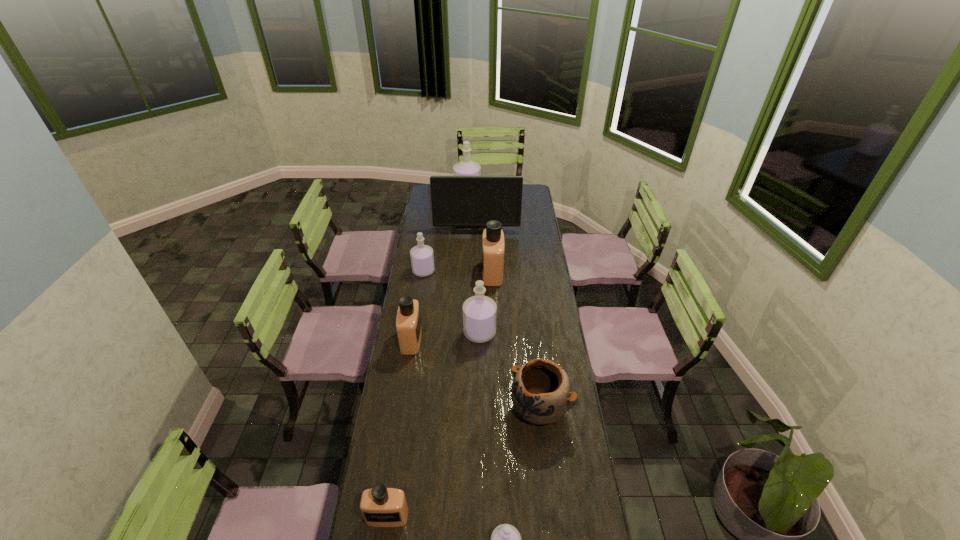
The height and width of the screenshot is (540, 960). I want to click on vacant space located on the front of the leftmost purple perfume, so click(x=416, y=321).

Identify the location of free point located 0.290m on the front label of the second smallest beige perfume. (487, 340).

This screenshot has height=540, width=960. Identify the location of free space located 0.140m on the back of the pottery. (534, 356).

Find the location of a particular element. object present at the far edge is located at coordinates (x=466, y=167).

You are a GUI agent. You are given a task and a screenshot of the screen. Output one action in this format:
    pyautogui.click(x=<x>, y=<y>)
    Task: Click on the computer monitor that is positioned at the left edge
    The image size is (960, 540).
    Given the screenshot: What is the action you would take?
    pyautogui.click(x=457, y=201)

The width and height of the screenshot is (960, 540). Find the location of `computer monitor that is at the right edge`. computer monitor that is at the right edge is located at coordinates (457, 201).

I want to click on pottery that is at the right edge, so click(x=541, y=393).

Locate an element on the screen. The height and width of the screenshot is (540, 960). free space at the left edge of the desktop is located at coordinates (410, 295).

In the image, there is a desktop. Where is `vacant space at the right edge`? This screenshot has height=540, width=960. vacant space at the right edge is located at coordinates (534, 238).

Locate an element on the screen. empty space that is in between the nearest beige perfume and the second nearest beige perfume is located at coordinates (399, 428).